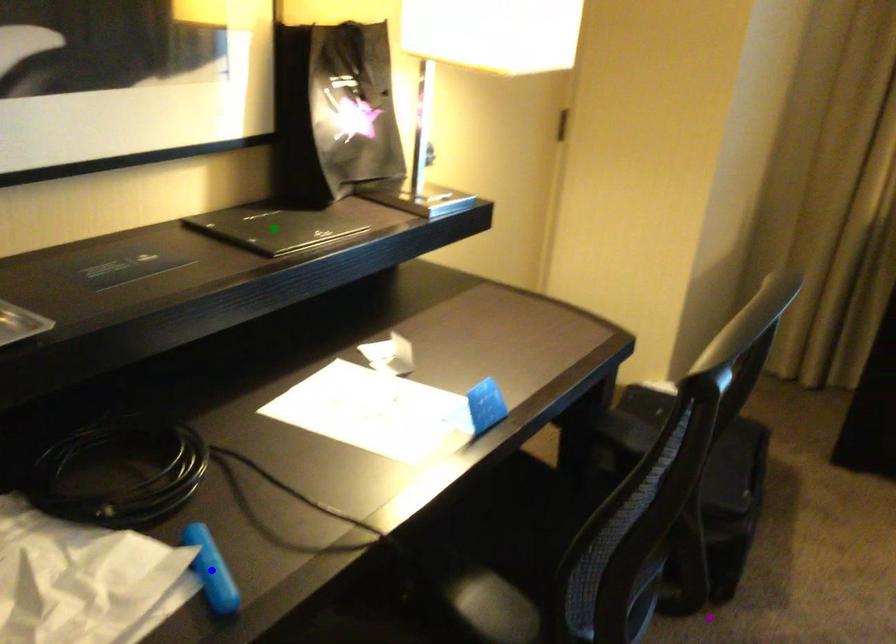
Based on the photo, order these from nearest to farthest:
1. green point
2. purple point
3. blue point

blue point
green point
purple point